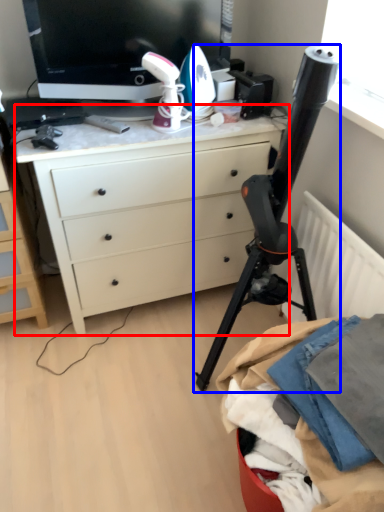
Question: Which object appears farthest to the camera in this image, desk (highlighted by a red box) or tripod (highlighted by a blue box)?

Choices:
 (A) desk
 (B) tripod

Answer: (A)